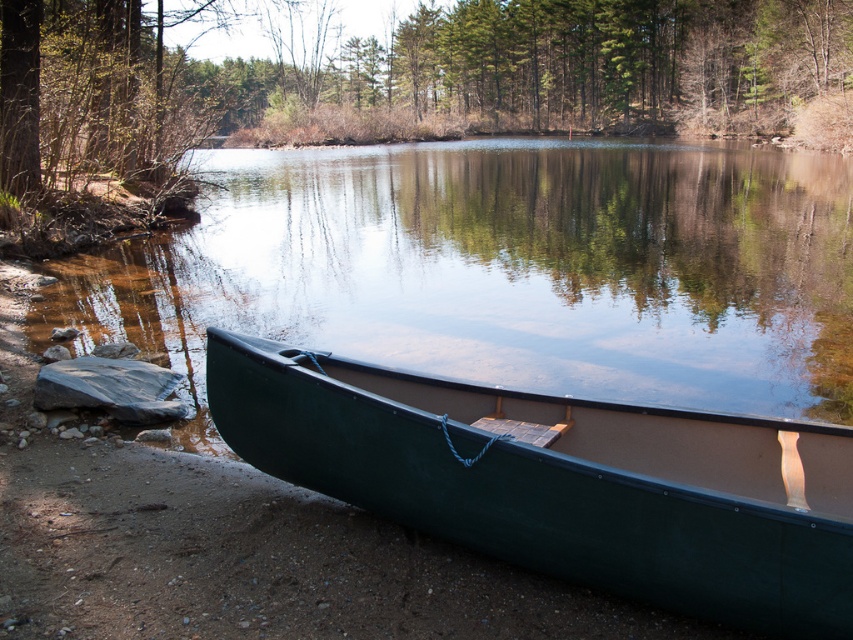
Question: Which of the following is the closest to the observer?

Choices:
 (A) clear water at center
 (B) green plastic canoe at lower center

Answer: (B)

Question: Is clear water at center below green plastic canoe at lower center?

Choices:
 (A) no
 (B) yes

Answer: (A)

Question: Can you confirm if clear water at center is thinner than green plastic canoe at lower center?

Choices:
 (A) no
 (B) yes

Answer: (A)

Question: Does clear water at center have a lesser width compared to green plastic canoe at lower center?

Choices:
 (A) no
 (B) yes

Answer: (A)

Question: Which of the following is the closest to the observer?

Choices:
 (A) (316, 392)
 (B) (305, 248)

Answer: (A)